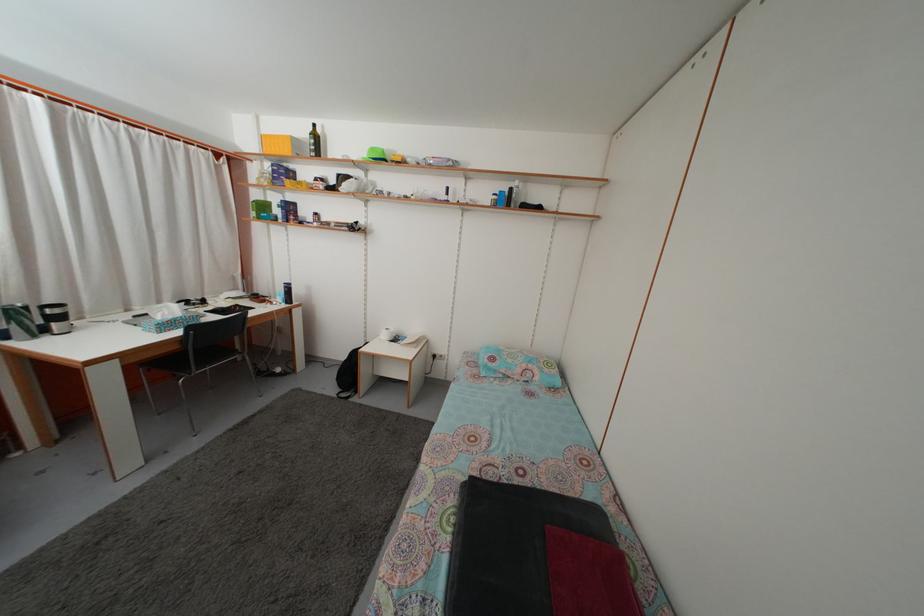
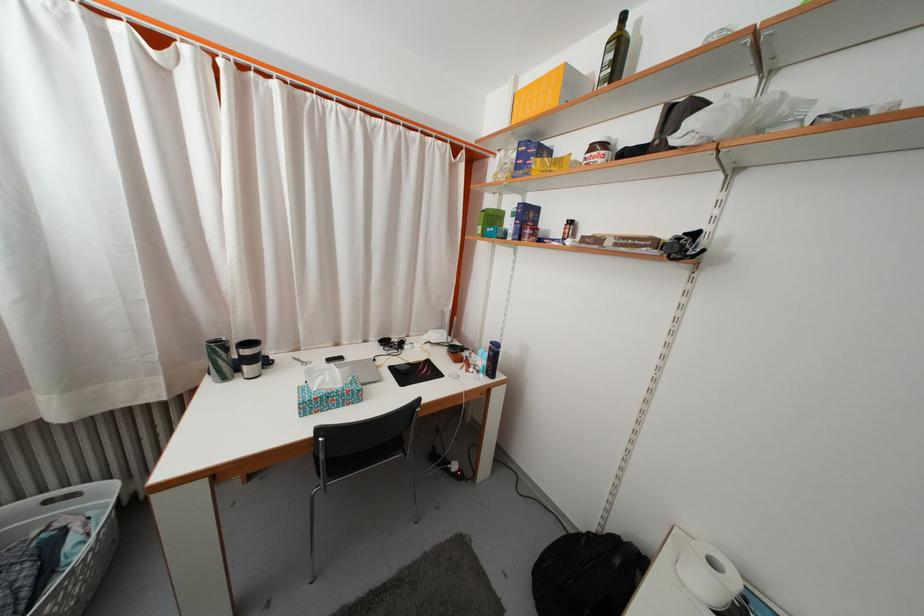
Find the pixel in the second image that matches [281,185] in the first image.

(523, 175)